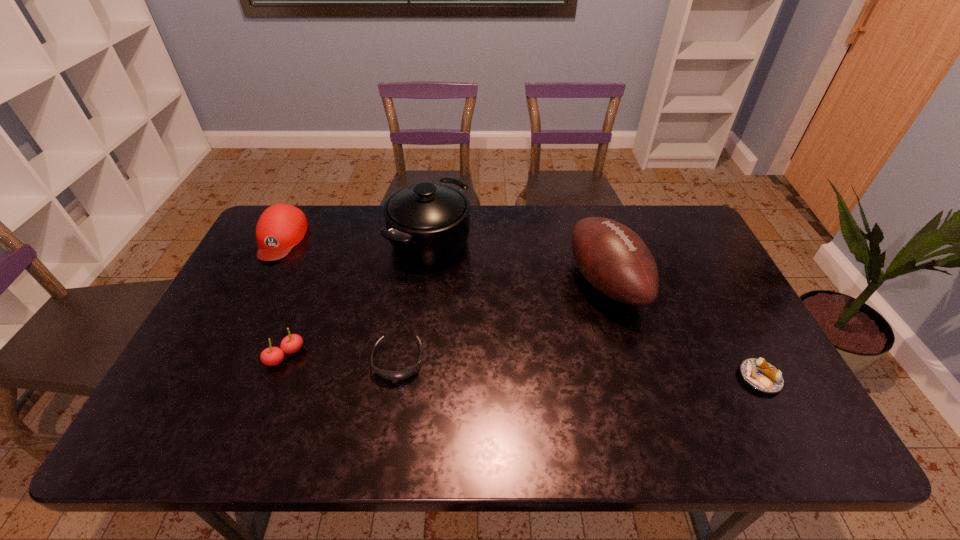
Identify the location of object that is at the far left corner. The height and width of the screenshot is (540, 960). (281, 227).

The image size is (960, 540). In order to click on free space at the far edge of the desktop in this screenshot , I will do `click(470, 218)`.

Locate an element on the screen. Image resolution: width=960 pixels, height=540 pixels. vacant space at the near edge is located at coordinates (556, 421).

In the image, there is a desktop. Where is `vacant space at the left edge`? vacant space at the left edge is located at coordinates (256, 267).

In the image, there is a desktop. Where is `free space at the right edge`? Image resolution: width=960 pixels, height=540 pixels. free space at the right edge is located at coordinates (701, 298).

In the image, there is a desktop. Where is `blank space at the far left corner`? Image resolution: width=960 pixels, height=540 pixels. blank space at the far left corner is located at coordinates (305, 239).

In the image, there is a desktop. Where is `vacant area at the near left corner`? vacant area at the near left corner is located at coordinates (150, 442).

You are a GUI agent. You are given a task and a screenshot of the screen. Output one action in this format:
    pyautogui.click(x=<x>, y=<y>)
    Task: Click on the blank space at the near right corner of the desktop
    The width and height of the screenshot is (960, 540).
    Given the screenshot: What is the action you would take?
    pyautogui.click(x=780, y=436)

The width and height of the screenshot is (960, 540). I want to click on empty location between the rightmost object and the saucepan, so tap(595, 309).

In order to click on empty location between the football (American) and the cherry in this screenshot , I will do `click(445, 319)`.